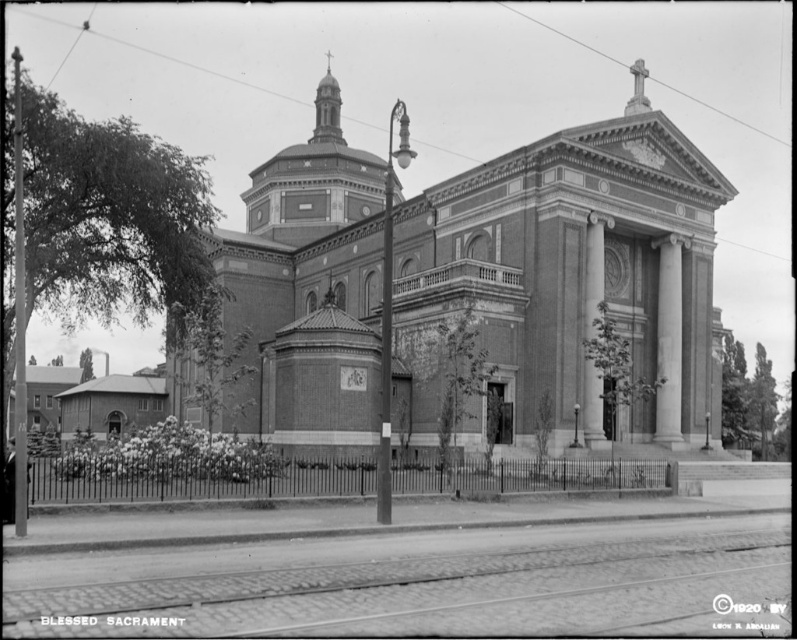
Which is more to the left, brick church at center or smooth stone column at center?

brick church at center

Describe the element at coordinates (558, 276) in the screenshot. The width and height of the screenshot is (797, 640). I see `brick church at center` at that location.

Looking at this image, who is more forward, (536, 289) or (601, 436)?

Positioned in front is point (601, 436).

Locate an element on the screen. The width and height of the screenshot is (797, 640). brick church at center is located at coordinates (558, 276).

Between white marble column at center and smooth stone column at center, which one is positioned lower?

Positioned lower is smooth stone column at center.

Is point (681, 248) positioned after point (585, 266)?

Yes.

Identify the location of white marble column at center. This screenshot has width=797, height=640. (668, 340).

Between point (265, 180) and point (662, 342), which one is positioned behind?

Positioned behind is point (265, 180).

What do you see at coordinates (558, 276) in the screenshot? I see `brick church at center` at bounding box center [558, 276].

At what (x,y) coordinates should I click in order to perform the action: click on brick church at center. Please return your answer as a coordinate pair (x, y). Looking at the image, I should click on (558, 276).